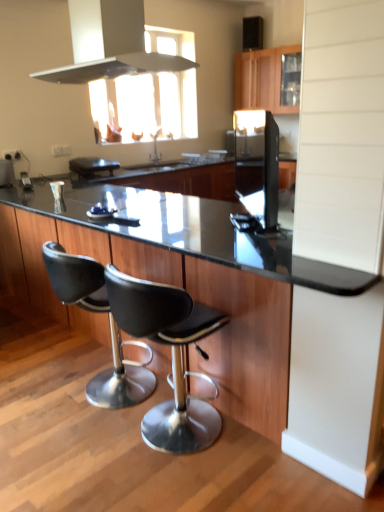
Question: From a real-world perspective, does wooden cabinet at upper center sit lower than metallic silver exhaust hood at upper center?

Choices:
 (A) no
 (B) yes

Answer: (B)

Question: Can you confirm if wooden cabinet at upper center is positioned to the right of metallic silver exhaust hood at upper center?

Choices:
 (A) no
 (B) yes

Answer: (B)

Question: Is wooden cabinet at upper center taller than metallic silver exhaust hood at upper center?

Choices:
 (A) yes
 (B) no

Answer: (A)

Question: Is wooden cabinet at upper center to the left of metallic silver exhaust hood at upper center from the viewer's perspective?

Choices:
 (A) yes
 (B) no

Answer: (B)

Question: Is metallic silver exhaust hood at upper center inside wooden cabinet at upper center?

Choices:
 (A) no
 (B) yes

Answer: (A)

Question: From the image's perspective, is wooden cabinet at upper center below metallic silver exhaust hood at upper center?

Choices:
 (A) yes
 (B) no

Answer: (B)

Question: From the image's perspective, is black leather stool at center, placed as the first chair when sorted from left to right, over black glass countertop at center, which ranks as the second countertop in left-to-right order?

Choices:
 (A) no
 (B) yes

Answer: (A)

Question: Is black glass countertop at center, which ranks as the second countertop in left-to-right order, completely or partially inside black leather stool at center, positioned as the second chair in right-to-left order?

Choices:
 (A) no
 (B) yes

Answer: (A)

Question: Can you confirm if black leather stool at center, positioned as the second chair in right-to-left order, is taller than black glass countertop at center, placed as the 1th countertop when sorted from right to left?

Choices:
 (A) yes
 (B) no

Answer: (B)

Question: From a real-world perspective, is black leather stool at center, placed as the first chair when sorted from left to right, on top of black glass countertop at center, which ranks as the second countertop in left-to-right order?

Choices:
 (A) yes
 (B) no

Answer: (B)

Question: Can you confirm if black leather stool at center, placed as the first chair when sorted from left to right, is bigger than black glass countertop at center, which ranks as the second countertop in left-to-right order?

Choices:
 (A) yes
 (B) no

Answer: (B)

Question: Is black leather stool at center, positioned as the second chair in right-to-left order, not near black glass countertop at center, placed as the 1th countertop when sorted from right to left?

Choices:
 (A) yes
 (B) no

Answer: (B)

Question: From the image's perspective, does black glass countertop at center, placed as the 1th countertop when sorted from right to left, appear higher than black leather stool at center, which is counted as the first chair, starting from the right?

Choices:
 (A) yes
 (B) no

Answer: (A)